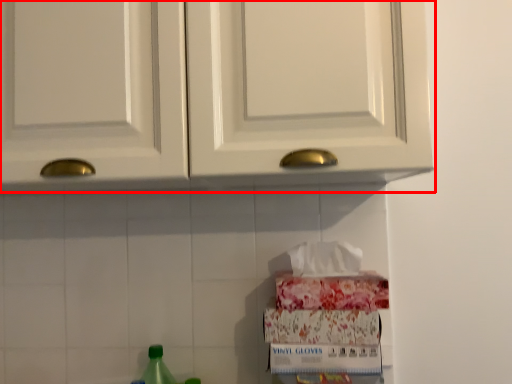
Question: From the image's perspective, what is the correct spatial relationship of cabinetry (annotated by the red box) in relation to bottle?

Choices:
 (A) below
 (B) above

Answer: (B)